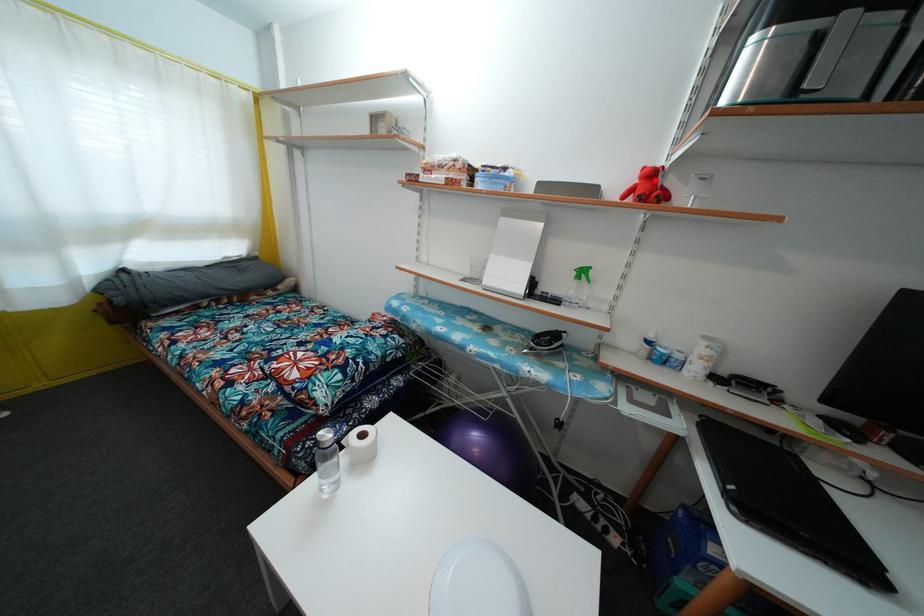
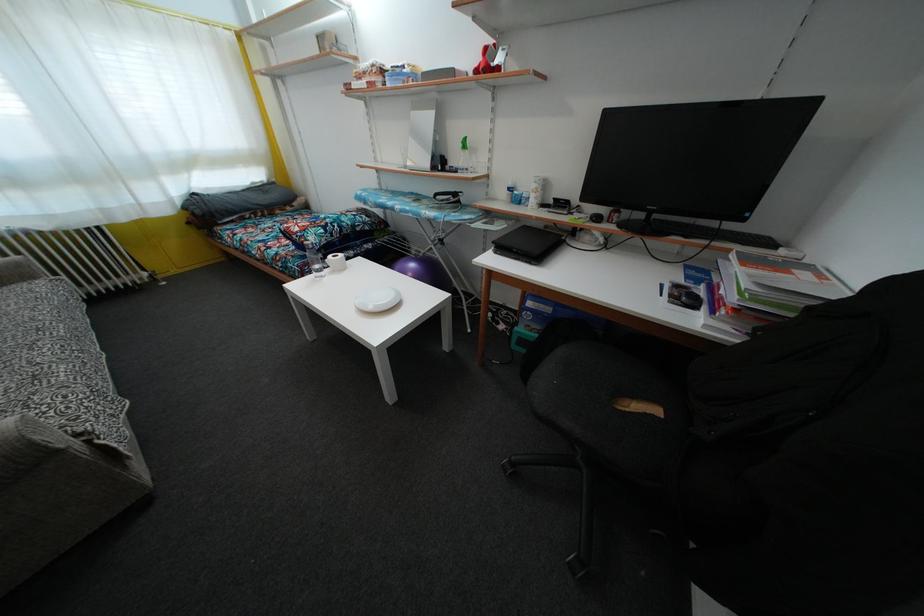
In the second image, find the point that corresponds to the highlighted location in the first image.

(490, 58)